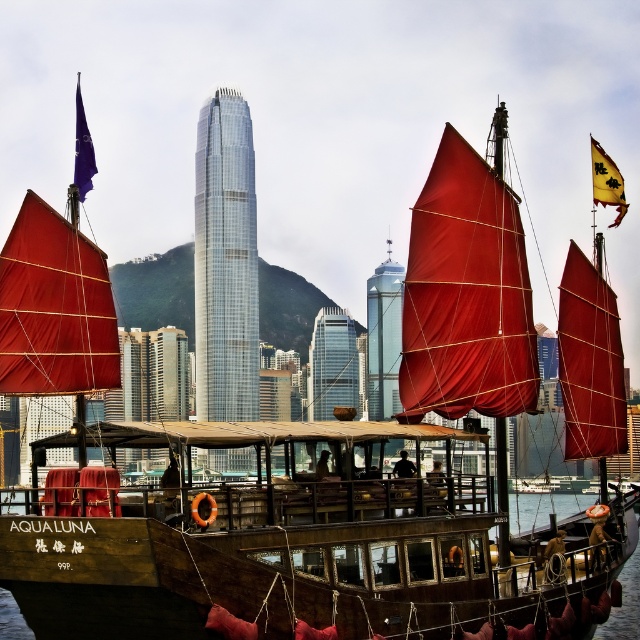
Based on the photo, you are a tourist standing on the dock and want to take a photo of the wooden boat at lower center and the matte red sail at center. Which object should you focus on first if you want to include both in your frame without moving the camera?

The wooden boat at lower center is larger in size than the matte red sail at center, so you should focus on the wooden boat at lower center first to ensure it fits properly in the frame before adjusting for the smaller sail.

You are a tour guide leading a group at Victoria Harbour. You need to ensure that the distance between the wooden boat at lower center and the matte red sail at center is safe for your group to walk between them. The safety guideline states that the minimum distance required for a safe path is 25 meters. Is the current distance sufficient?

The wooden boat at lower center and matte red sail at center are 27.12 meters apart, which exceeds the required 25 meters for a safe path. Therefore, the distance is sufficient for your group to walk between them safely.

You are standing at the observation deck of the IFC tower and notice two points in the distance. The first point is located at coordinates point (474, 570) and the second point is at point (420, 412). Which point is closer to you?

Point (474, 570) is closer to the viewer than point (420, 412).